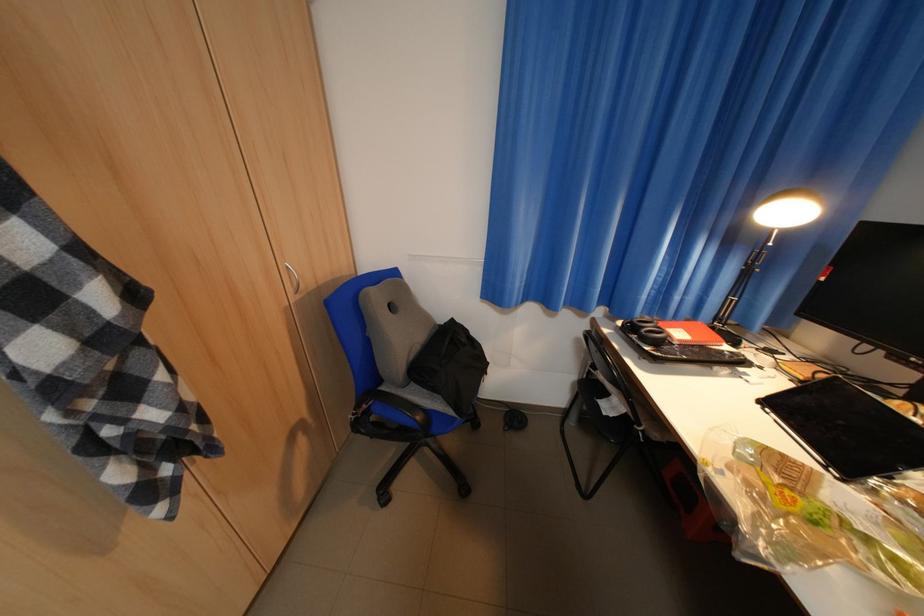
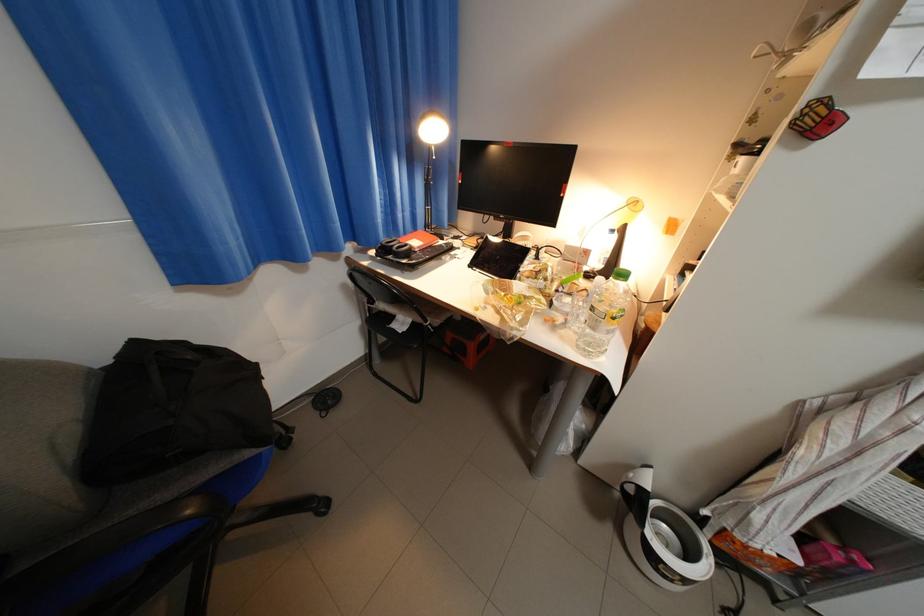
The point at (589, 341) is marked in the first image. Where is the corresponding point in the second image?

(355, 286)